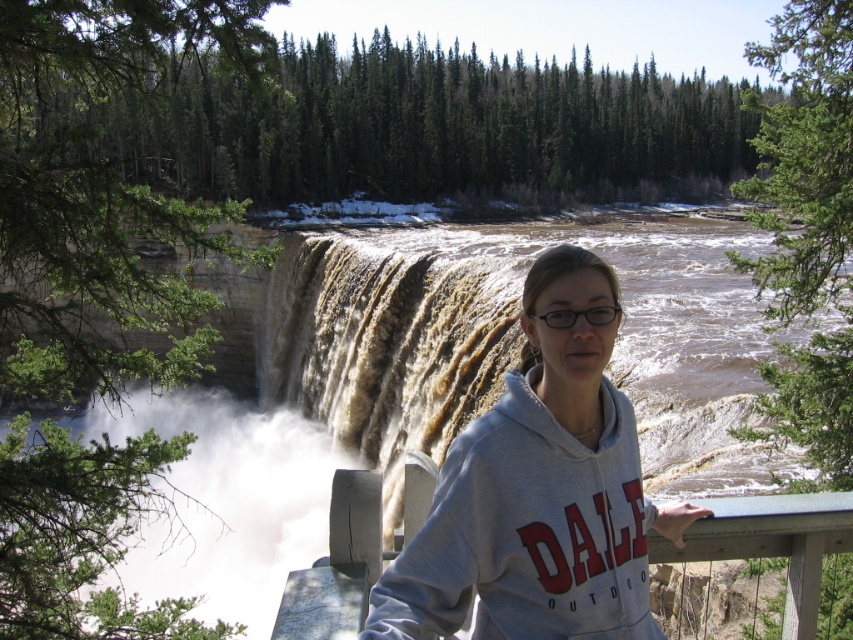
Consider the image. You are a photographer standing at the camera position. You want to capture a photo of the waterfall and the woman. The woman is at point [216,416]. The waterfall is at point 0.450, 0.750. Which object is closer to the camera?

The woman at point [216,416] is closer to the camera than the waterfall at point 0.450, 0.750 because the distance of point [216,416] from camera is 74.37 meters.

You are the woman in the image standing near the railing overlooking the waterfall. You want to know if your sweatshirt is currently above or below the water in the scene. Based on the description, what is the relationship between the gray fleece sweatshirt at center and the brown textured water at center?

The brown textured water at center is above the gray fleece sweatshirt at center, meaning the water is positioned higher up in the scene than the sweatshirt.

What is located at the coordinates point (x=434, y=385) in the image?

At point (x=434, y=385) lies brown textured water at center.